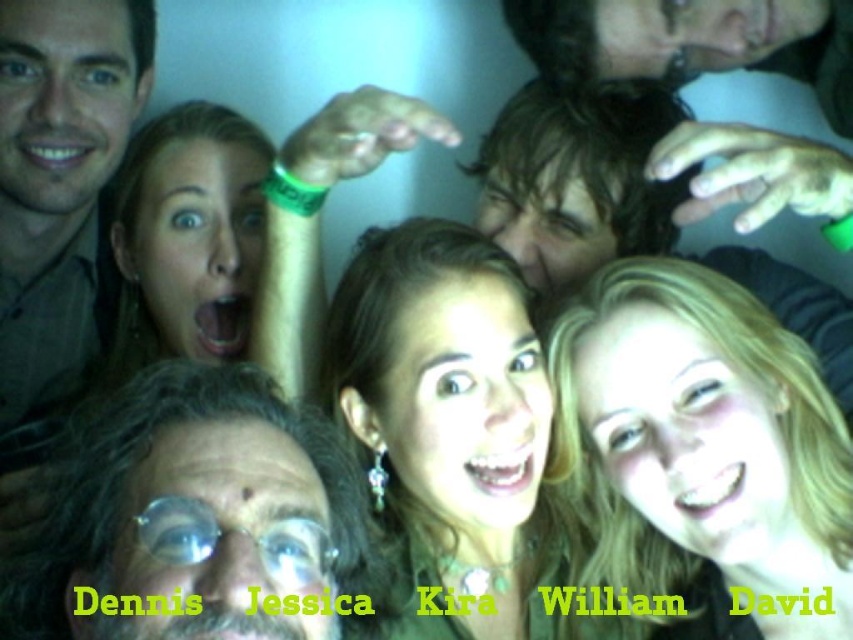
You are taking a photo and want to ensure the blonde hair at center is in focus. Based on their position, where should you aim the camera focus point?

The blonde hair at center is located at point (x=700, y=448), so you should aim the camera focus point at those coordinates to ensure it is in focus.

You are a photographer trying to adjust the lighting for a group photo. You notice the shiny gold necklace at center and the matte brown shirt at left. How far apart are these two items in inches?

The distance between the shiny gold necklace at center and the matte brown shirt at left is 20.55 inches.